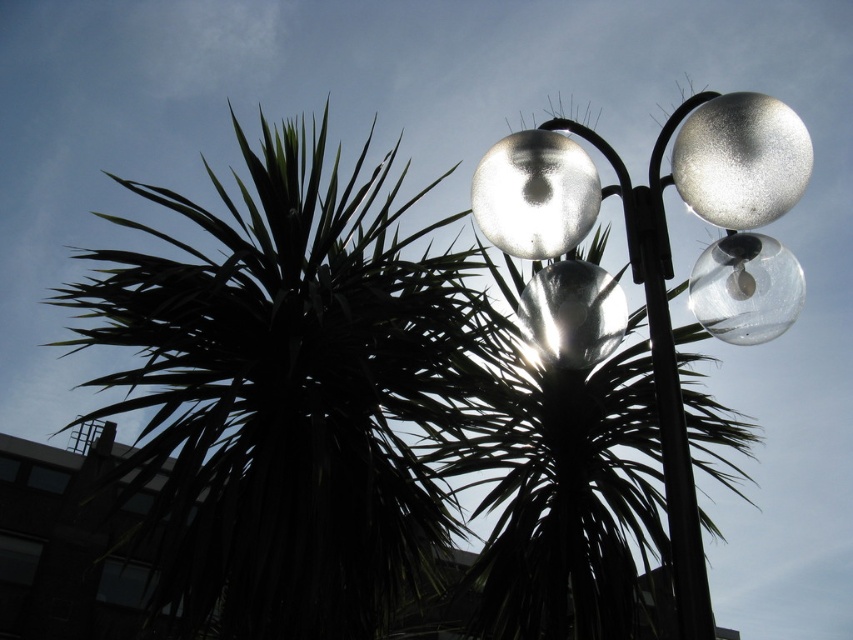
Which is more to the left, metallic silver sphere at upper right or glossy glass light at upper center?

From the viewer's perspective, glossy glass light at upper center appears more on the left side.

Who is positioned more to the right, metallic silver sphere at upper right or glossy glass light at upper center?

From the viewer's perspective, metallic silver sphere at upper right appears more on the right side.

At what (x,y) coordinates should I click in order to perform the action: click on metallic silver sphere at upper right. Please return your answer as a coordinate pair (x, y). Looking at the image, I should click on (741, 160).

Is point (525, 228) more distant than point (561, 140)?

No.

Does satin silver globes at upper right appear over glossy glass light at upper center?

Actually, satin silver globes at upper right is below glossy glass light at upper center.

Between point (508, 157) and point (521, 248), which one is positioned behind?

Positioned behind is point (521, 248).

Find the location of `satin silver globes at upper right`. satin silver globes at upper right is located at coordinates (666, 252).

Is satin silver globes at upper right shorter than satin silver lamp at center?

No, satin silver globes at upper right is not shorter than satin silver lamp at center.

Who is positioned more to the left, satin silver globes at upper right or satin silver lamp at center?

From the viewer's perspective, satin silver lamp at center appears more on the left side.

Does point (689, 173) come behind point (543, 301)?

No, (689, 173) is closer to viewer.

Identify the location of satin silver globes at upper right. (666, 252).